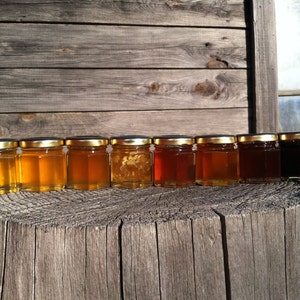
Identify the location of jars containing light substance. The height and width of the screenshot is (300, 300). (3, 166), (39, 166).